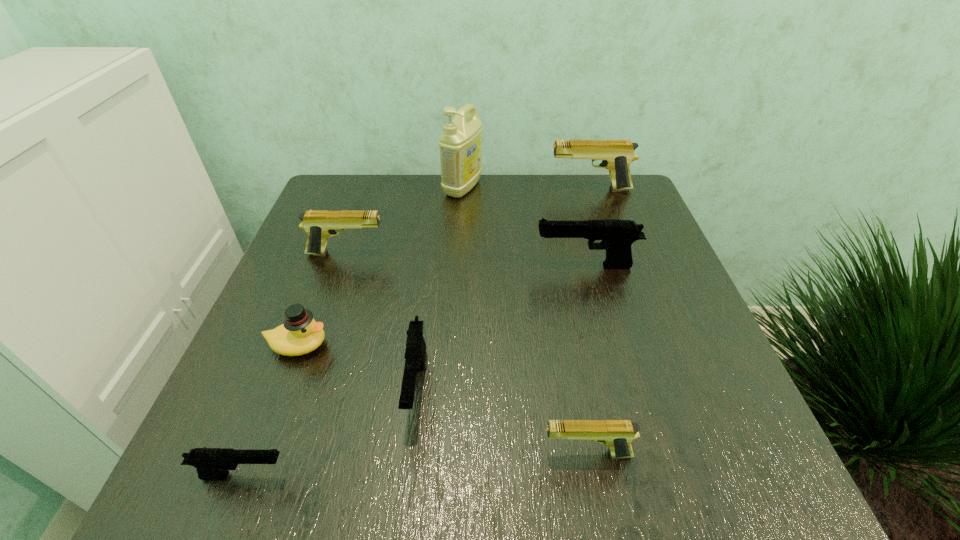
Find the location of a particular element. This screenshot has width=960, height=540. duck at the left edge is located at coordinates [299, 334].

You are a GUI agent. You are given a task and a screenshot of the screen. Output one action in this format:
    pyautogui.click(x=<x>, y=<y>)
    Task: Click on the object situated at the near left corner
    The image size is (960, 540).
    Given the screenshot: What is the action you would take?
    pyautogui.click(x=211, y=463)

Locate an element on the screen. This screenshot has width=960, height=540. object at the far right corner is located at coordinates (616, 155).

The image size is (960, 540). I want to click on vacant space at the far edge of the desktop, so click(576, 215).

In the image, there is a desktop. What are the coordinates of `vacant space at the left edge` in the screenshot? It's located at (335, 309).

Identify the location of free spot at the right edge of the desktop. (677, 331).

Image resolution: width=960 pixels, height=540 pixels. I want to click on vacant region at the far left corner, so click(365, 198).

Image resolution: width=960 pixels, height=540 pixels. What are the coordinates of `free space at the near left corner of the desktop` in the screenshot? It's located at (285, 475).

Find the location of a particular element. vacant space at the near right corner is located at coordinates (683, 472).

This screenshot has height=540, width=960. What are the coordinates of `free space between the yellow duck and the second black pistol from right to left` in the screenshot? It's located at (357, 366).